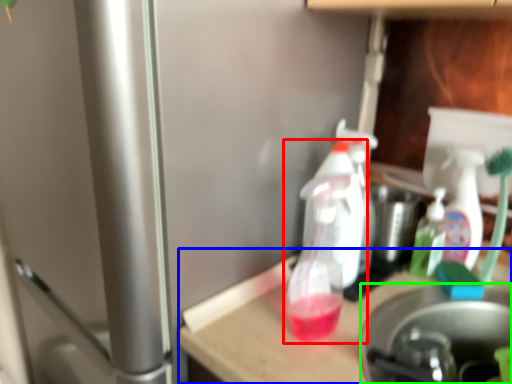
Question: Which is nearer to the bottle (highlighted by a red box)? table (highlighted by a blue box) or appliance (highlighted by a green box).

Choices:
 (A) table
 (B) appliance

Answer: (A)